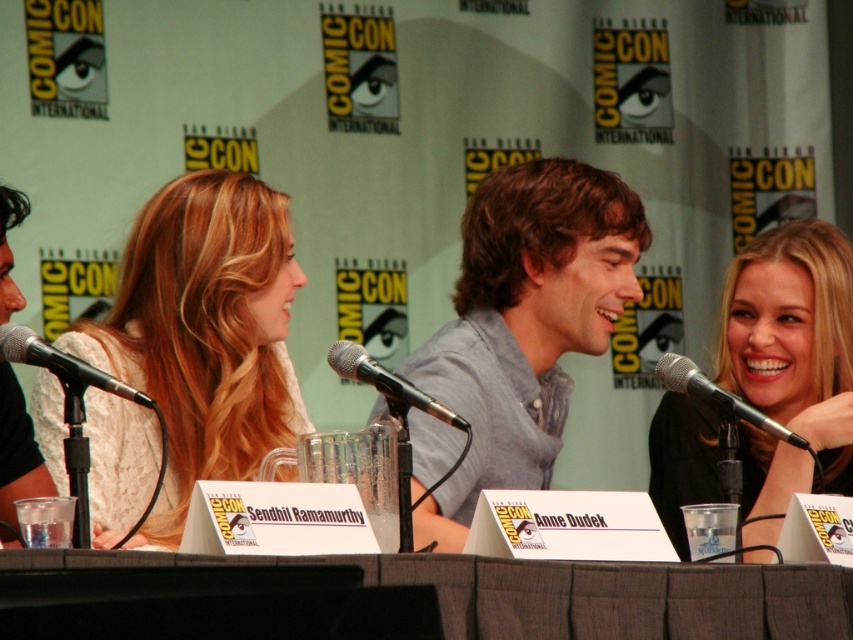
Question: In this image, where is black metallic microphone at left located relative to black metallic microphone at center?

Choices:
 (A) above
 (B) below

Answer: (A)

Question: Considering the relative positions of black fabric table at center and white lace dress at center in the image provided, where is black fabric table at center located with respect to white lace dress at center?

Choices:
 (A) right
 (B) left

Answer: (A)

Question: Based on their relative distances, which object is nearer to the gray cotton shirt at center?

Choices:
 (A) black fabric table at center
 (B) white lace dress at center

Answer: (B)

Question: Can you confirm if black metallic microphone at left is positioned to the right of black metallic microphone at upper right?

Choices:
 (A) no
 (B) yes

Answer: (A)

Question: Which point appears farthest from the camera in this image?

Choices:
 (A) (0, 339)
 (B) (827, 378)
 (C) (86, 582)
 (D) (531, 248)

Answer: (B)

Question: Which object appears farthest from the camera in this image?

Choices:
 (A) black metallic microphone at upper right
 (B) gray cotton shirt at center
 (C) black metallic microphone at left
 (D) black fabric table at center

Answer: (B)